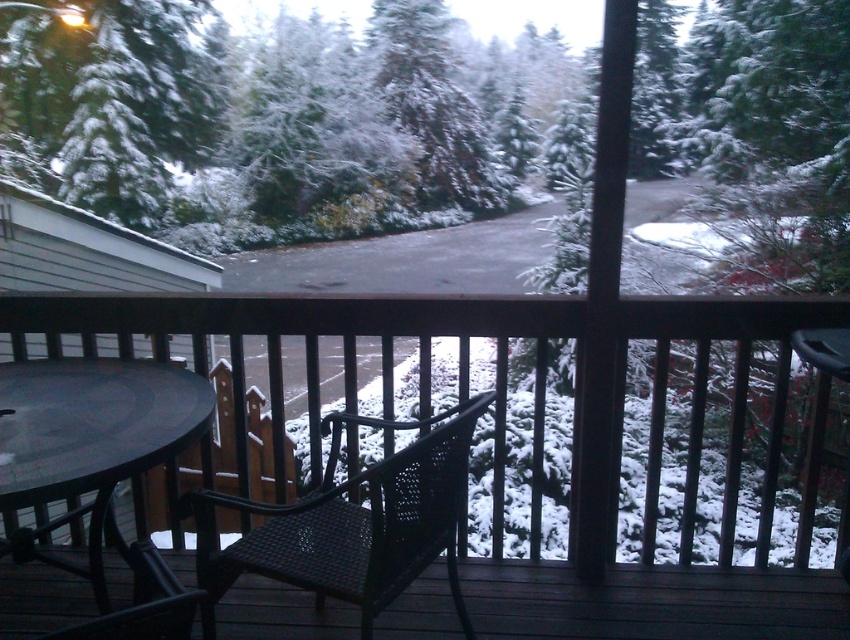
Does black mesh chair at center have a greater height compared to black wicker chair at center?

No.

Does black mesh chair at center appear on the right side of black wicker chair at center?

Yes, black mesh chair at center is to the right of black wicker chair at center.

Does point (312, 618) lie in front of point (378, 566)?

That is False.

At what (x,y) coordinates should I click in order to perform the action: click on black mesh chair at center. Please return your answer as a coordinate pair (x, y). Image resolution: width=850 pixels, height=640 pixels. Looking at the image, I should click on (652, 602).

Who is taller, black mesh chair at center or black matte table at lower left?

black matte table at lower left is taller.

Can you confirm if black mesh chair at center is wider than black matte table at lower left?

Indeed, black mesh chair at center has a greater width compared to black matte table at lower left.

Which is in front, point (55, 602) or point (151, 573)?

Point (151, 573) is in front.

At what (x,y) coordinates should I click in order to perform the action: click on black mesh chair at center. Please return your answer as a coordinate pair (x, y). The image size is (850, 640). Looking at the image, I should click on (652, 602).

How far apart are black mesh chair at center and matte black chair at center?

black mesh chair at center is 46.36 centimeters away from matte black chair at center.

Can you confirm if black mesh chair at center is taller than matte black chair at center?

No, black mesh chair at center is not taller than matte black chair at center.

Where is `black mesh chair at center`? This screenshot has width=850, height=640. black mesh chair at center is located at coordinates (652, 602).